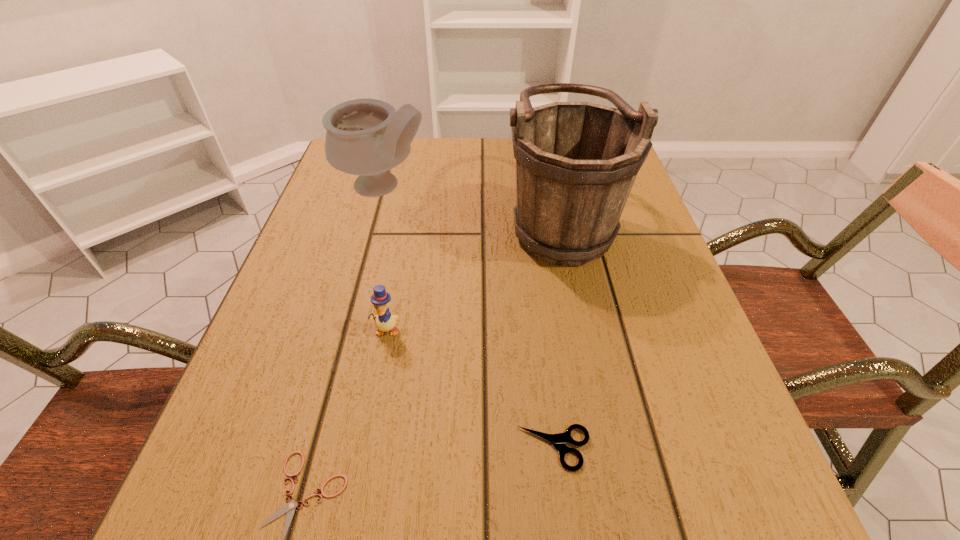
Identify the location of vacant space at the left edge of the desktop. This screenshot has height=540, width=960. (348, 211).

Identify the location of vacant space at the right edge of the desktop. The height and width of the screenshot is (540, 960). (643, 261).

Image resolution: width=960 pixels, height=540 pixels. What are the coordinates of `free space at the far left corner` in the screenshot? It's located at (336, 186).

You are a GUI agent. You are given a task and a screenshot of the screen. Output one action in this format:
    pyautogui.click(x=<x>, y=<y>)
    Task: Click on the blank space at the near left corner
    
    Given the screenshot: What is the action you would take?
    pos(206,506)

Locate an element on the screen. free space that is in between the pottery and the fourth tallest object is located at coordinates (469, 318).

Locate an element on the screen. This screenshot has width=960, height=540. free area in between the taller shears and the third shortest object is located at coordinates (470, 389).

The image size is (960, 540). I want to click on free spot between the third shortest object and the taller shears, so click(x=470, y=389).

In order to click on free space between the third farthest object and the tallest object in this screenshot , I will do click(473, 274).

This screenshot has height=540, width=960. I want to click on object that is the third closest to the second shortest object, so click(x=576, y=162).

Select which object appears as the second closest to the tallest object. Please provide its 2D coordinates. Your answer should be formatted as a tuple, i.e. [(x, y)], where the tuple contains the x and y coordinates of a point satisfying the conditions above.

[(385, 321)]